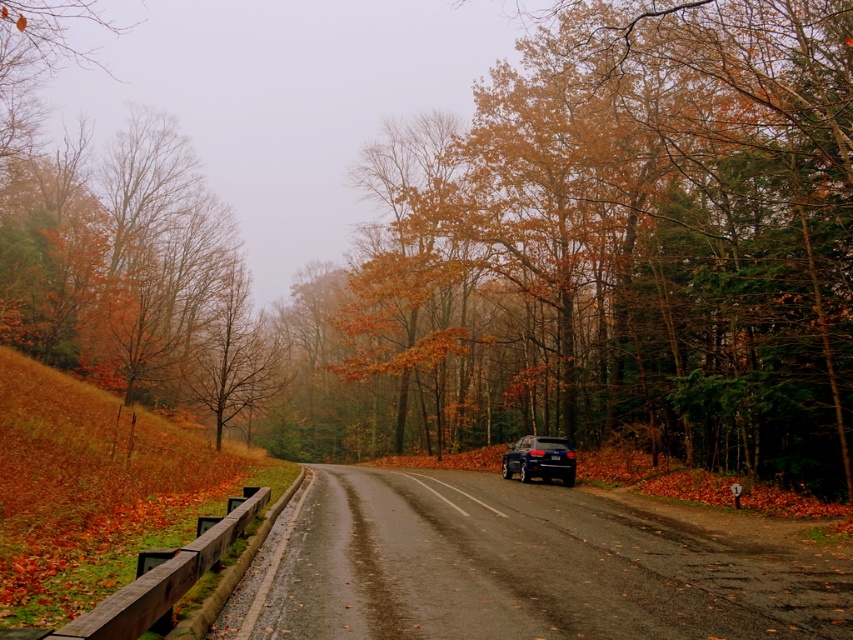
Question: In this image, where is orange leafy tree at center located relative to glossy black suv at center?

Choices:
 (A) left
 (B) right

Answer: (A)

Question: Observing the image, what is the correct spatial positioning of orange leafy tree at center in reference to glossy black suv at center?

Choices:
 (A) left
 (B) right

Answer: (A)

Question: Does orange leafy tree at center appear on the right side of glossy black suv at center?

Choices:
 (A) no
 (B) yes

Answer: (A)

Question: Which of the following is the closest to the observer?

Choices:
 (A) (558, 438)
 (B) (534, 369)

Answer: (A)

Question: Which point is closer to the camera taking this photo?

Choices:
 (A) (762, 333)
 (B) (520, 476)

Answer: (A)